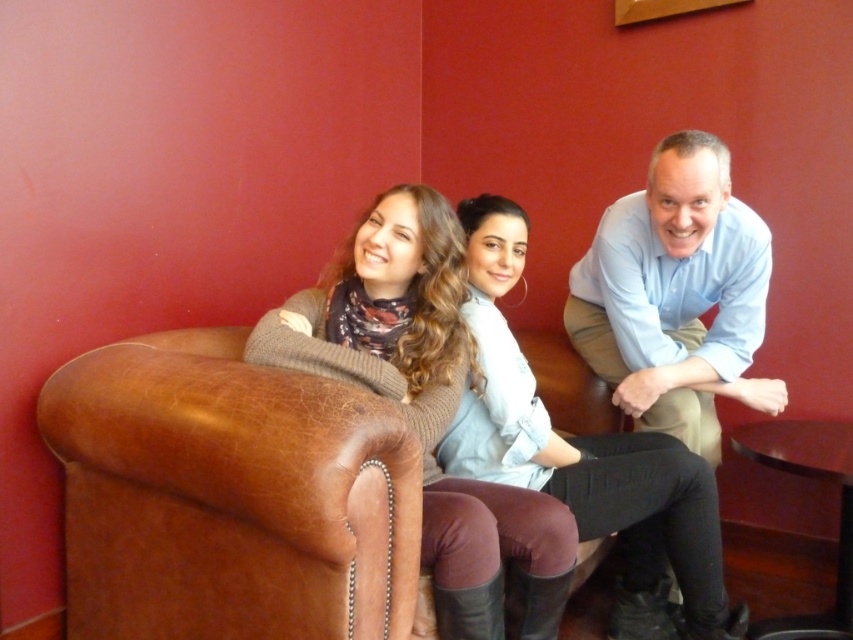
You are standing in front of the image and want to locate the matte brown sweater at center. According to the coordinates provided, where exactly is it positioned?

The matte brown sweater at center is positioned at coordinates point (427, 404).

From the picture: You are a fashion designer observing a photo shoot setup. In the image, there are two central items of clothing displayed on the models. The first is a matte brown sweater at center, and the second is a light blue shirt at center. Which clothing item appears taller in the image?

The matte brown sweater at center has a greater height compared to the light blue shirt at center, so the matte brown sweater at center appears taller in the image.

You are trying to decide which light blue top to wear for a casual day out. You have two options in the image, the light blue shirt at center and the light blue denim shirt at center. Based on their lengths, which one would reach lower on your body?

The light blue denim shirt at center is longer than the light blue shirt at center, so it would reach lower on your body.